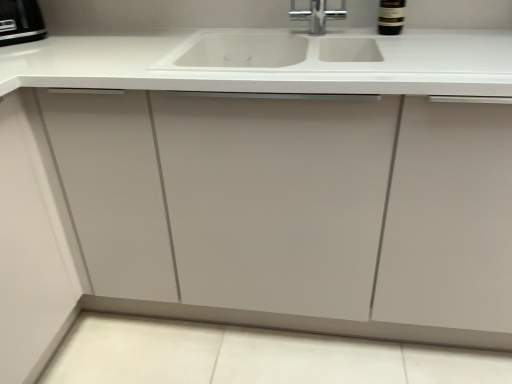
The height and width of the screenshot is (384, 512). Find the location of `free location to the left of dark brown glass bottle at upper right`. free location to the left of dark brown glass bottle at upper right is located at coordinates (335, 35).